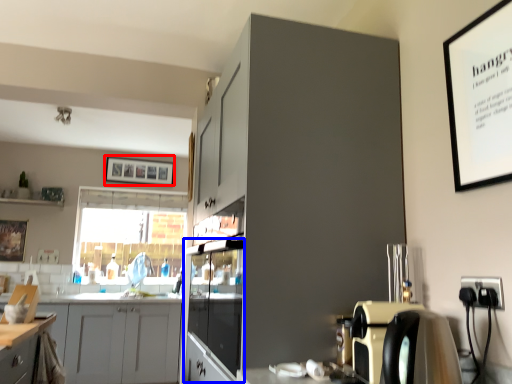
Question: Which object is closer to the camera taking this photo, picture frame (highlighted by a red box) or glass door (highlighted by a blue box)?

Choices:
 (A) picture frame
 (B) glass door

Answer: (B)